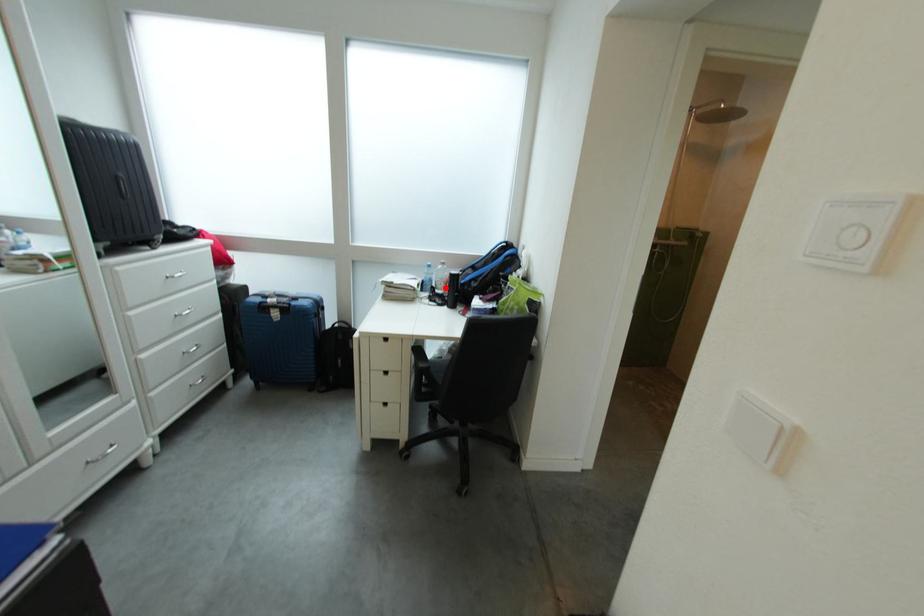
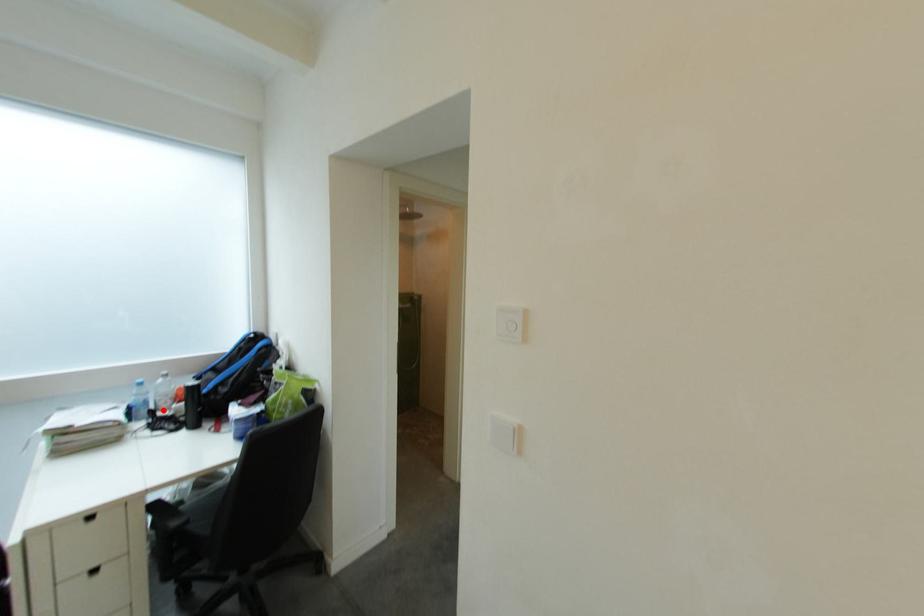
I am providing you with two images of the same scene from different viewpoints. A red point is marked on the first image and another point is marked on the second image. Is the marked point in image1 the same physical position as the marked point in image2?

Yes